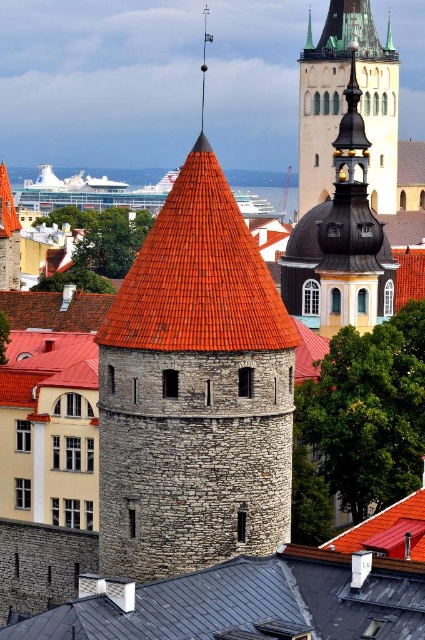
Is gold textured dome at upper center further to camera compared to green glass spire at upper center?

No, it is not.

Is point (339, 3) positioned after point (311, 45)?

No, (339, 3) is closer to viewer.

This screenshot has width=425, height=640. In order to click on gold textured dome at upper center in this screenshot , I will do `click(343, 104)`.

Which is below, black metal roof at center or gold textured dome at upper center?

Positioned lower is black metal roof at center.

Can you confirm if black metal roof at center is positioned below gold textured dome at upper center?

Correct, black metal roof at center is located below gold textured dome at upper center.

Is point (53, 636) closer to viewer compared to point (370, 179)?

Yes, it is.

Locate an element on the screen. black metal roof at center is located at coordinates (252, 602).

Is black metal roof at center further to the viewer compared to green glass spire at upper center?

That is False.

Between point (90, 608) and point (306, 40), which one is positioned in front?

Point (90, 608) is in front.

Is point (319, 561) closer to camera compared to point (308, 40)?

Yes, it is.

Find the location of `black metal roof at center`. black metal roof at center is located at coordinates (252, 602).